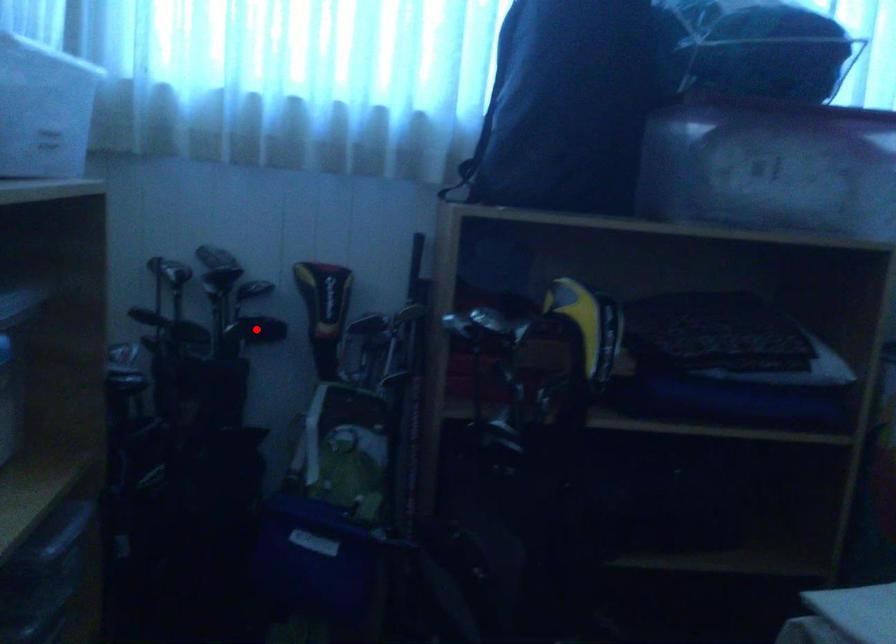
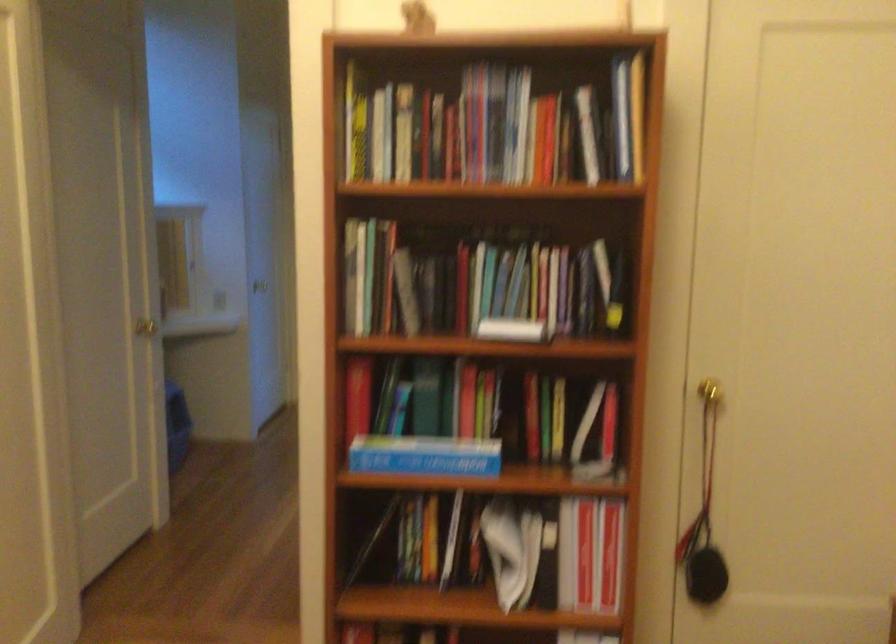
Question: I am providing you with two images of the same scene from different viewpoints. A red point is marked on the first image. Is the red point's position out of view in image 2?

Choices:
 (A) Yes
 (B) No

Answer: (A)